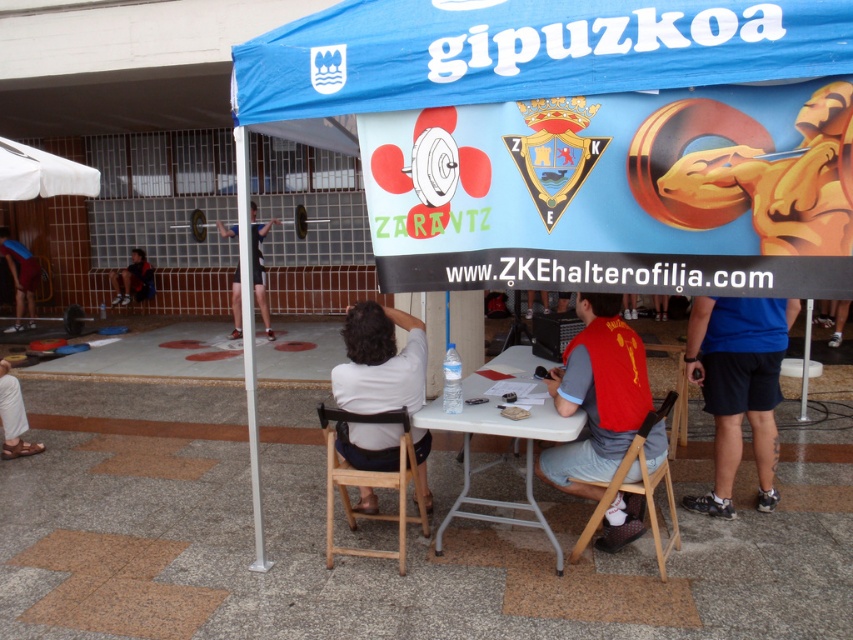
Question: Which point is farther to the camera?

Choices:
 (A) dark blue shorts at lower left
 (B) white fabric canopy at upper left
 (C) blue fabric shorts at lower right
 (D) blue fabric tent at upper center

Answer: (A)

Question: Is white plastic pole at left in front of dark blue shirt at center?

Choices:
 (A) no
 (B) yes

Answer: (B)

Question: Which object is positioned closest to the white fabric canopy at upper left?

Choices:
 (A) red fabric vest at center
 (B) white plastic table at center

Answer: (B)

Question: Which is nearer to the blue fabric tent at upper center?

Choices:
 (A) white plastic pole at left
 (B) dark blue shorts at lower left
 (C) white fabric shirt at center

Answer: (C)

Question: Is blue fabric shorts at lower right behind dark blue shorts at lower left?

Choices:
 (A) yes
 (B) no

Answer: (B)

Question: Does matte black shorts at lower left appear over dark blue shorts at lower left?

Choices:
 (A) yes
 (B) no

Answer: (B)